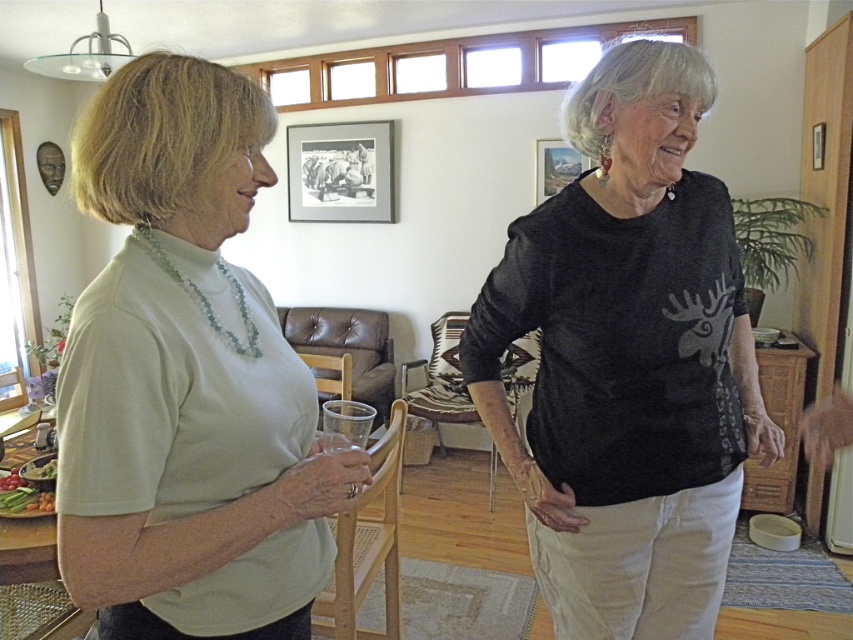
You are standing in the living room and want to hang a new picture frame between the metallic silver picture frame at upper center and the metallic silver picture frame at upper right. Is there enough space to place it in between them?

The metallic silver picture frame at upper center is to the left of metallic silver picture frame at upper right, so there is space between them to hang a new picture frame.